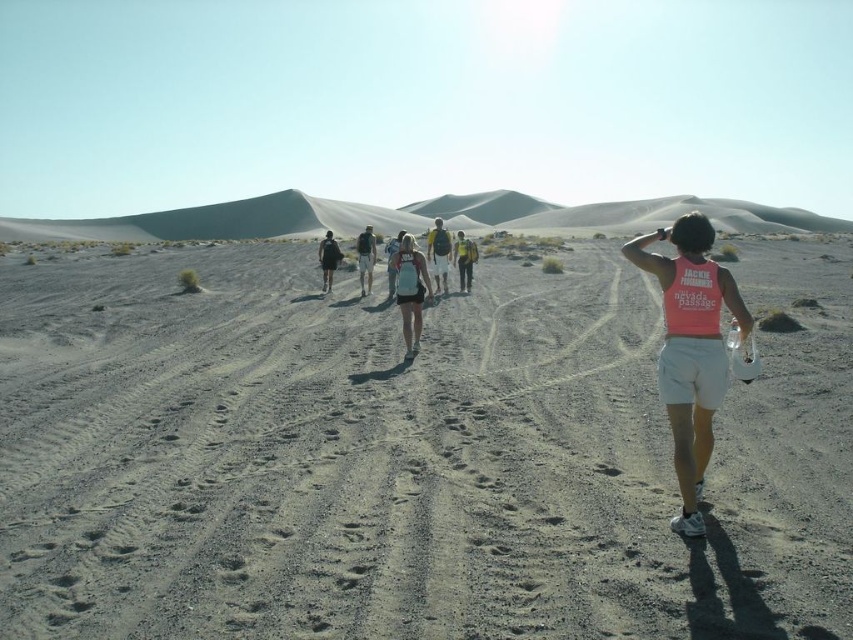
You are a hiker planning to climb the white sand dune at upper center. You notice the yellow fabric backpack at center is placed at the base of the dune. How does the height of the dune compare to the backpack?

The white sand dune at upper center is taller than the yellow fabric backpack at center, so the dune is significantly higher than the backpack.